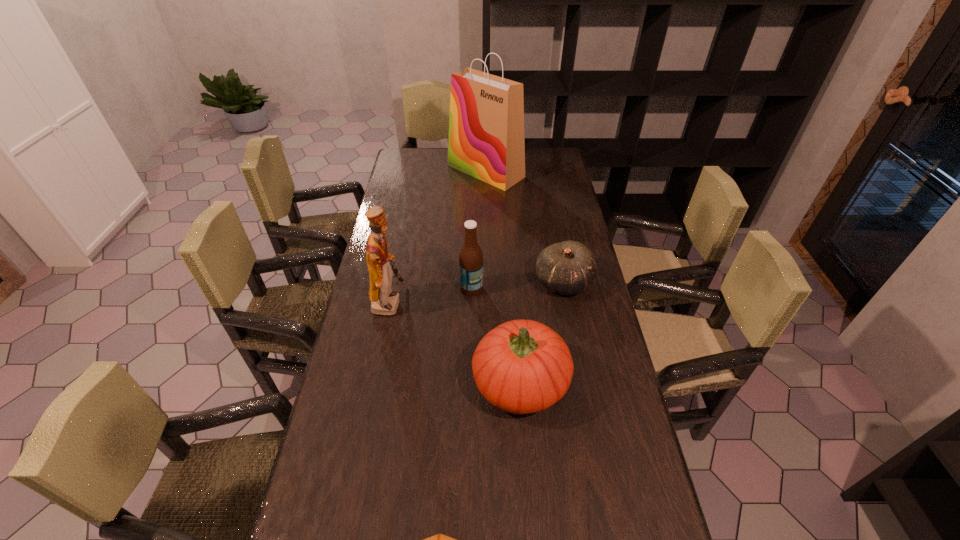
Image resolution: width=960 pixels, height=540 pixels. In order to click on shopping bag in this screenshot , I will do `click(486, 140)`.

Where is `the farthest object`? The width and height of the screenshot is (960, 540). the farthest object is located at coordinates (486, 140).

You are a GUI agent. You are given a task and a screenshot of the screen. Output one action in this format:
    pyautogui.click(x=<x>, y=<y>)
    Task: Click on the second tallest object
    Image resolution: width=960 pixels, height=540 pixels.
    Given the screenshot: What is the action you would take?
    pyautogui.click(x=384, y=301)

Locate an element on the screen. nutcracker is located at coordinates (384, 301).

At what (x,y) coordinates should I click in order to perform the action: click on beer bottle. Please return your answer as a coordinate pair (x, y). The height and width of the screenshot is (540, 960). Looking at the image, I should click on (471, 258).

At what (x,y) coordinates should I click in order to perform the action: click on the fourth tallest object. Please return your answer as a coordinate pair (x, y). The image size is (960, 540). Looking at the image, I should click on (522, 366).

Where is `the fifth farthest object`? This screenshot has height=540, width=960. the fifth farthest object is located at coordinates point(522,366).

What are the coordinates of `the farther gourd` in the screenshot? It's located at (567, 268).

Where is `vacant space located on the front of the shopping bag`? vacant space located on the front of the shopping bag is located at coordinates (487, 242).

Identify the location of vacant space situated on the front-facing side of the nutcracker. (468, 302).